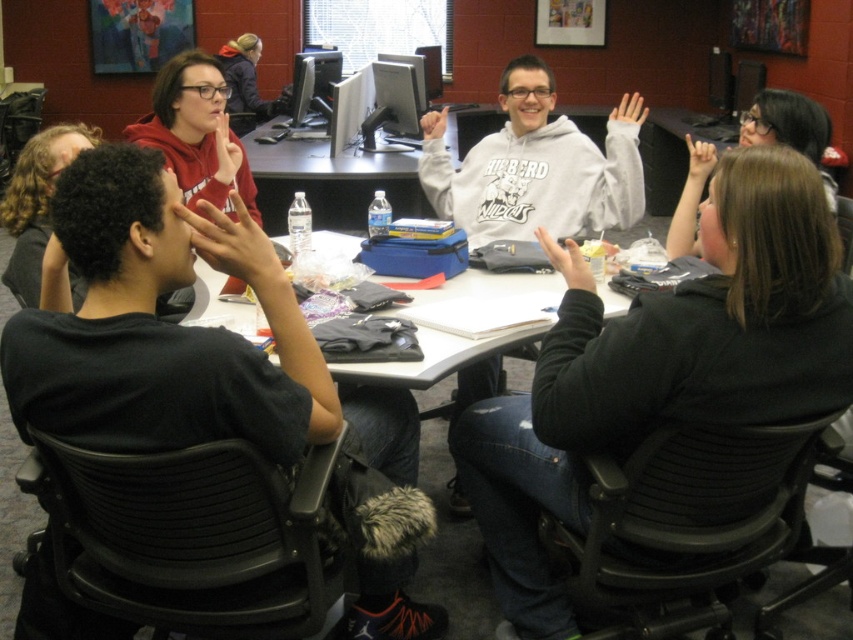
Question: Observing the image, what is the correct spatial positioning of brown hair at upper right in reference to smooth skin hand at center?

Choices:
 (A) right
 (B) left

Answer: (A)

Question: Which point is closer to the camera taking this photo?

Choices:
 (A) (260, 109)
 (B) (567, 342)

Answer: (B)

Question: Which point is closer to the camera?

Choices:
 (A) gray hoodie at center
 (B) black t-shirt at left
 (C) matte black hand at upper center
 (D) matte black hand at center

Answer: (B)

Question: Which object is closer to the camera taking this photo?

Choices:
 (A) matte black hand at center
 (B) matte black hoodie at upper left
 (C) black t-shirt at left

Answer: (C)

Question: Is white matte hand at upper center smaller than matte gray hand at center?

Choices:
 (A) yes
 (B) no

Answer: (B)

Question: Is brown hair at upper right above smooth skin hand at center?

Choices:
 (A) no
 (B) yes

Answer: (B)